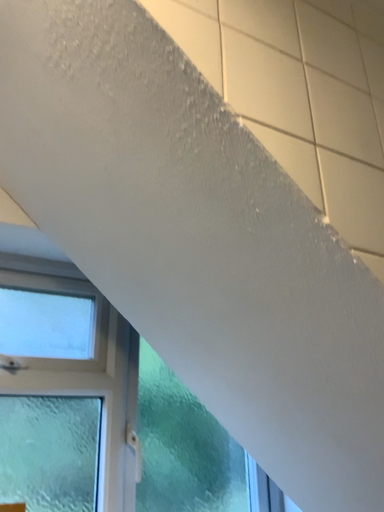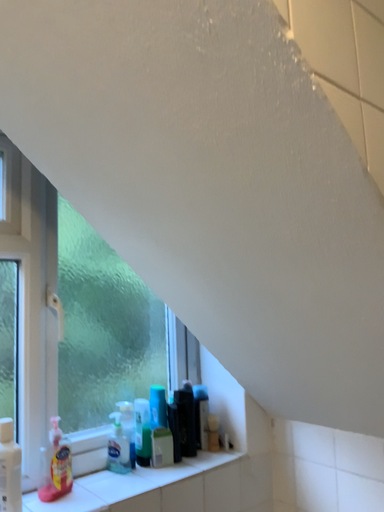
Question: How did the camera likely rotate when shooting the video?

Choices:
 (A) rotated downward
 (B) rotated upward

Answer: (A)